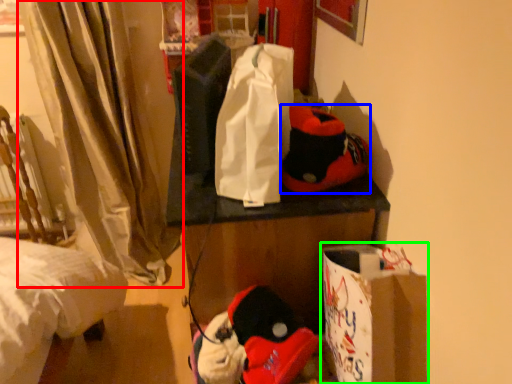
Question: Considering the real-world distances, which object is closest to curtain (highlighted by a red box)? twin (highlighted by a blue box) or cardboard box (highlighted by a green box).

Choices:
 (A) twin
 (B) cardboard box

Answer: (A)